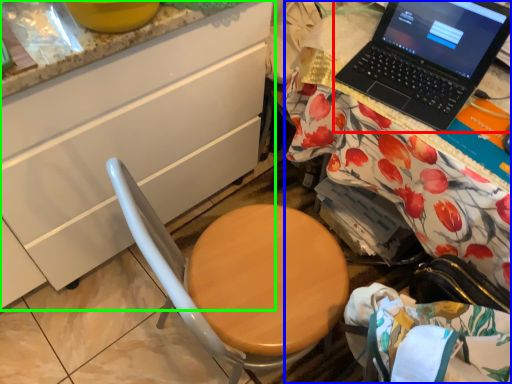
Question: Which object is positioned closest to laptop (highlighted by a red box)? Select from desk (highlighted by a blue box) and cabinetry (highlighted by a green box).

Choices:
 (A) desk
 (B) cabinetry

Answer: (A)